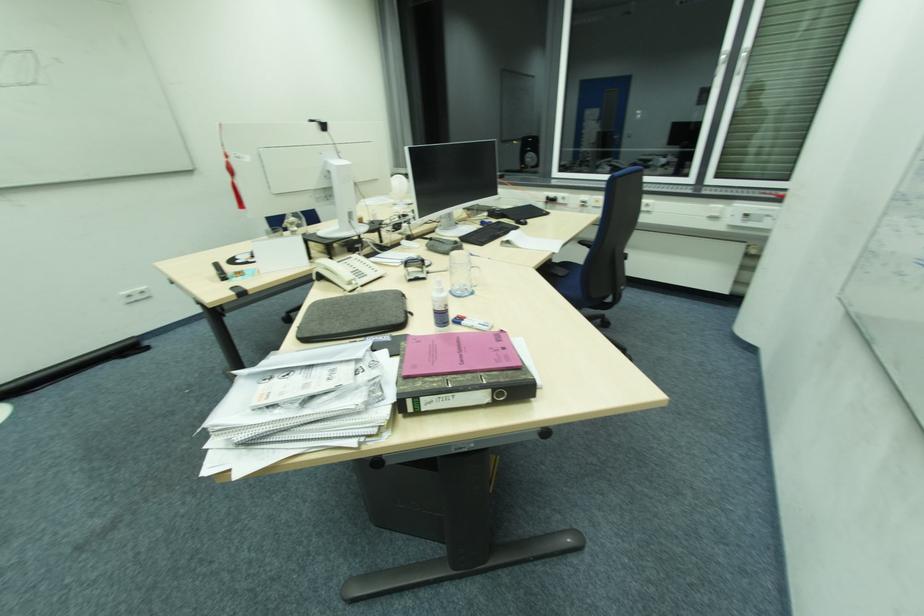
Where would you pull the black binder hole? Please return your answer as a coordinate pair (x, y).

(353, 315)